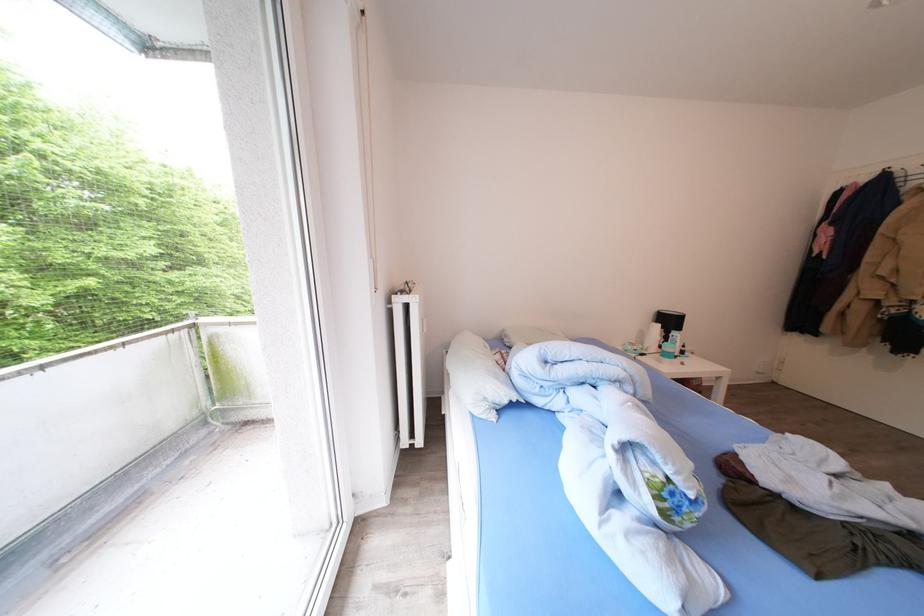
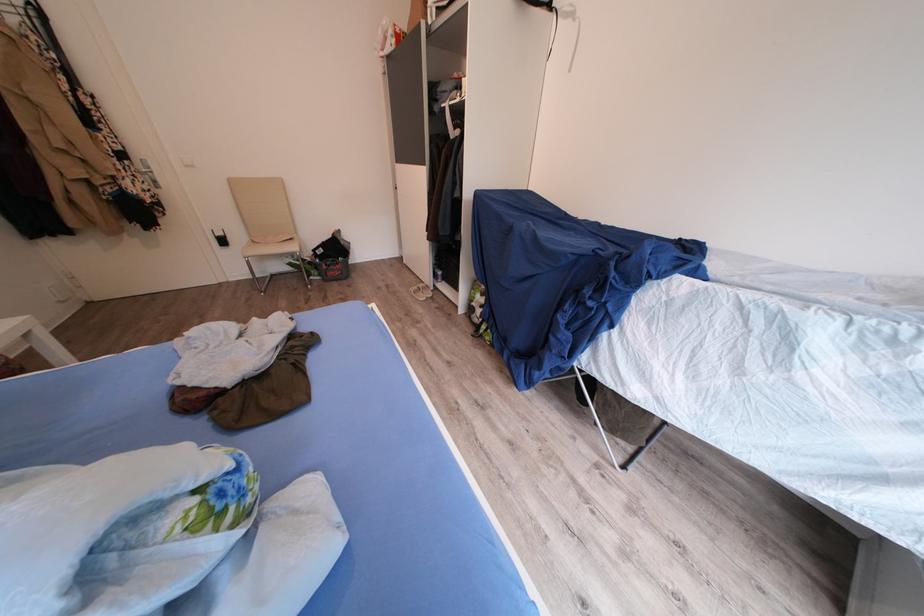
How did the camera likely rotate?

The rotation direction of the camera is right-down.